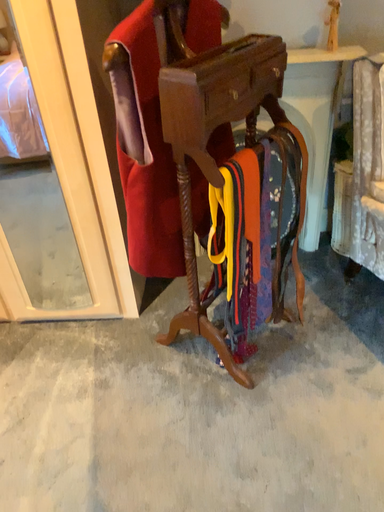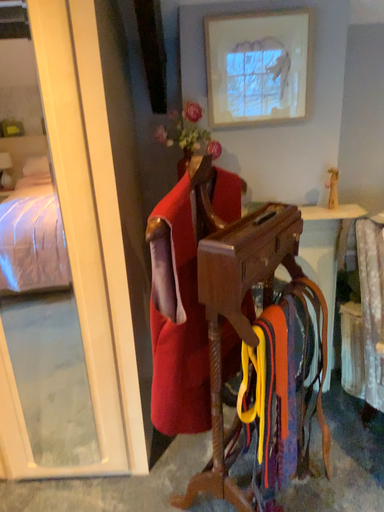
Question: How did the camera likely rotate when shooting the video?

Choices:
 (A) rotated upward
 (B) rotated downward

Answer: (A)